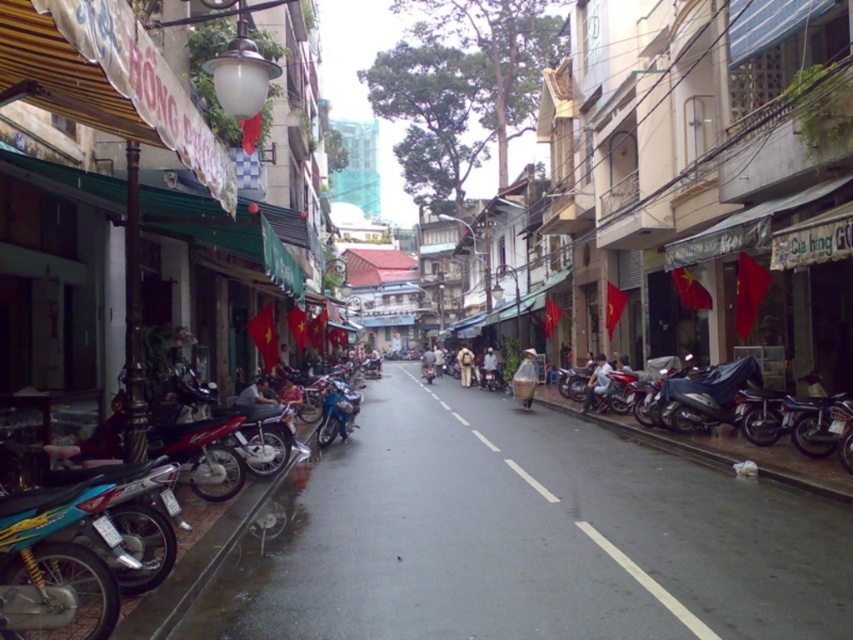
Which is more to the right, blue metallic motorcycle at center or matte plastic bag at center?

From the viewer's perspective, matte plastic bag at center appears more on the right side.

Is point (339, 428) positioned in front of point (525, 401)?

Yes, point (339, 428) is in front of point (525, 401).

Identify the location of blue metallic motorcycle at center. The image size is (853, 640). click(x=335, y=412).

Which is behind, point (529, 376) or point (488, 385)?

Positioned behind is point (488, 385).

Does matte plastic bag at center come behind white plastic bag at center?

No.

What are the coordinates of `matte plastic bag at center` in the screenshot? It's located at (525, 378).

Can you confirm if white matte shirt at center-right is smaller than white plastic bag at center?

No.

Between white matte shirt at center-right and white plastic bag at center, which one has more height?

white matte shirt at center-right is taller.

Between point (596, 356) and point (486, 355), which one is positioned in front?

Point (596, 356)

Where is `white matte shirt at center-right`? Image resolution: width=853 pixels, height=640 pixels. white matte shirt at center-right is located at coordinates (596, 381).